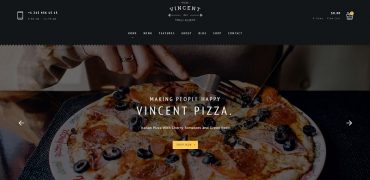
Where is `button in seat`? This screenshot has height=180, width=370. button in seat is located at coordinates (304, 84).